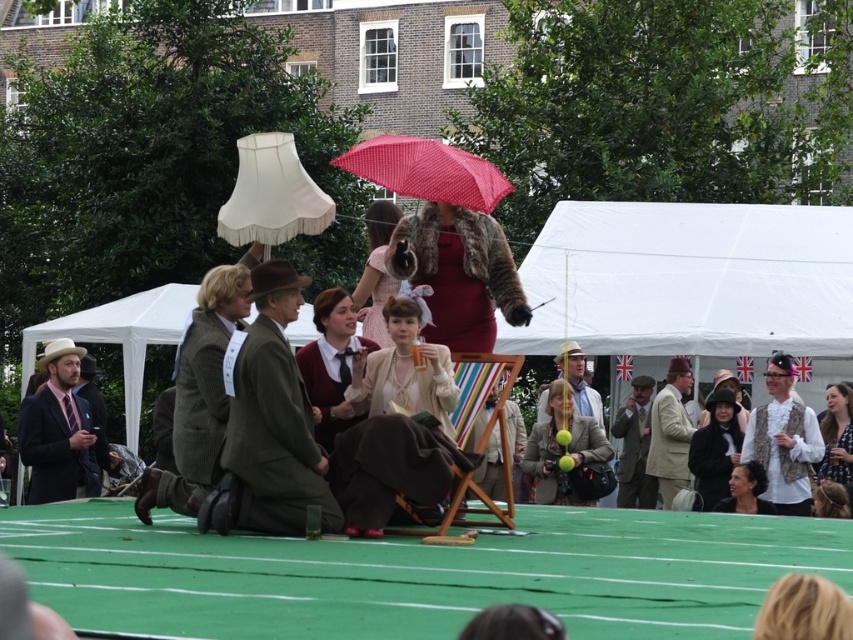
You are organizing a photo shoot and need to know which object takes up more space in the image. Based on the scene, which one is larger between the matte beige coat at center and the blue floral dress at lower right?

The blue floral dress at lower right occupies more space than the matte beige coat at center according to the description.

You are a photographer standing at the edge of the stage. You need to take a photo that includes both the matte beige dress at center and the matte black suit at left. Given that your camera has a maximum focus range of 15 meters, will you be able to capture both subjects in focus without moving closer?

The matte beige dress at center and the matte black suit at left are 17.74 meters apart. Since your camera can only focus up to 15 meters, capturing both in focus without moving closer is not possible.

You are at an outdoor event and see the matte beige dress at center and the white fabric canopy at left. Which object is located above the other?

The white fabric canopy at left is above the matte beige dress at center because the matte beige dress at center is positioned under it.